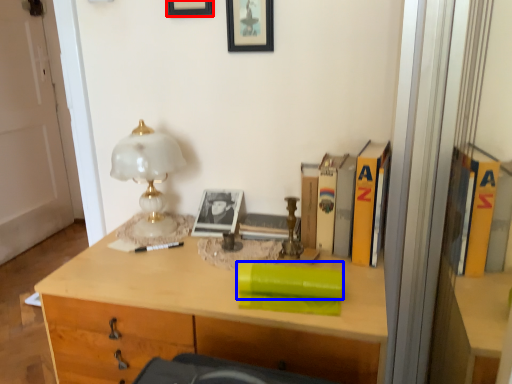
Question: Among these objects, which one is farthest to the camera, picture frame (highlighted by a red box) or book (highlighted by a blue box)?

Choices:
 (A) picture frame
 (B) book

Answer: (A)